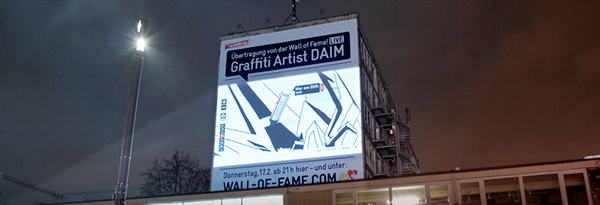
Identify the location of lights turned off. (240, 25), (266, 21), (320, 12).